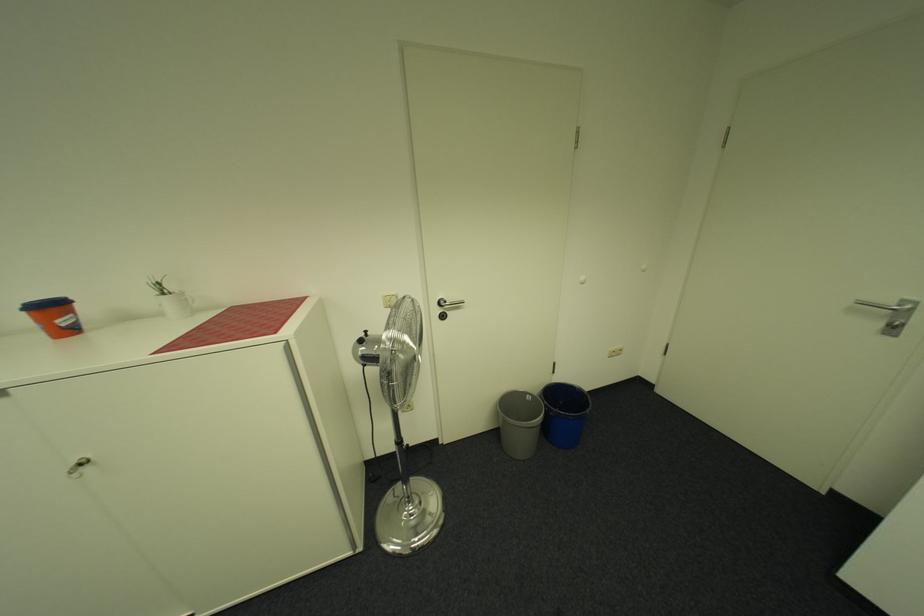
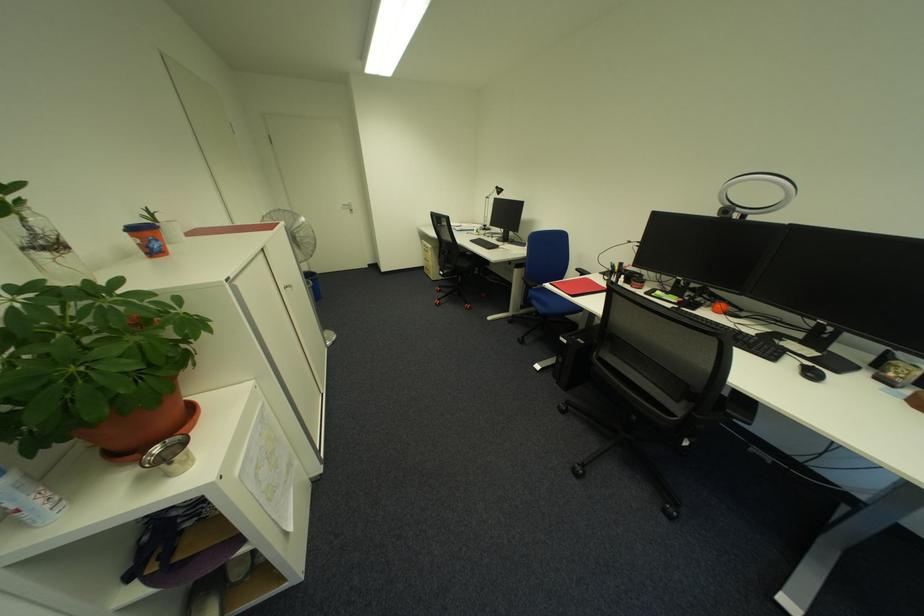
Where in the second image is the point corresponding to point 79,331 from the first image?

(164, 254)